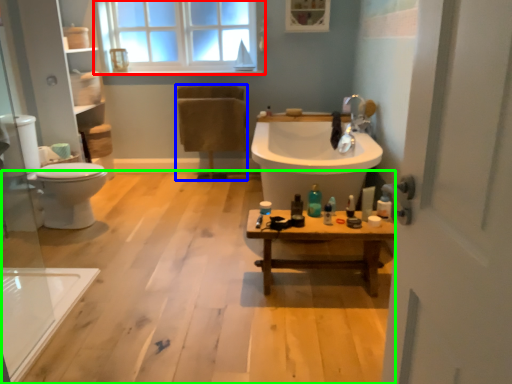
Question: Estimate the real-world distances between objects in this image. Which object is farther from window (highlighted by a red box), chair (highlighted by a blue box) or plain (highlighted by a green box)?

Choices:
 (A) chair
 (B) plain

Answer: (B)